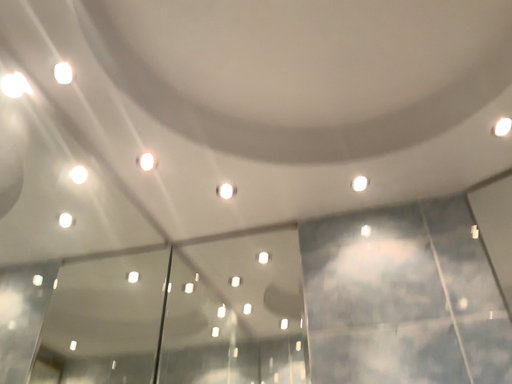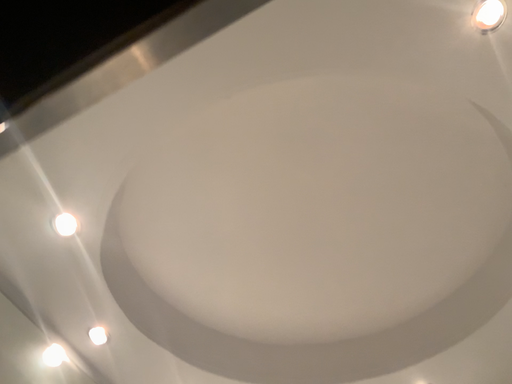
Question: Which way did the camera rotate in the video?

Choices:
 (A) rotated right
 (B) rotated left

Answer: (B)